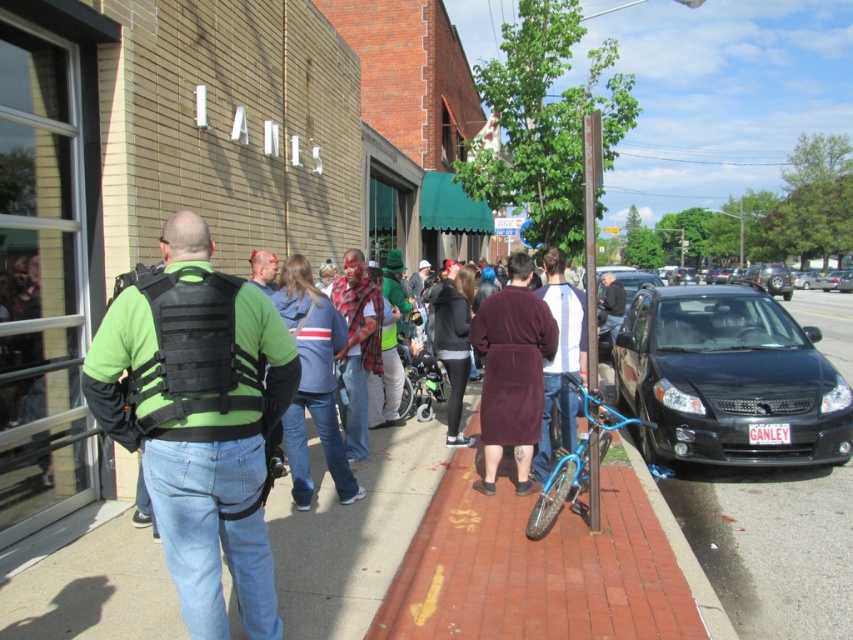
Is shiny blue bicycle at center above dark gray hoodie at center?

No, shiny blue bicycle at center is not above dark gray hoodie at center.

Is shiny blue bicycle at center in front of dark gray hoodie at center?

Yes, shiny blue bicycle at center is in front of dark gray hoodie at center.

You are a GUI agent. You are given a task and a screenshot of the screen. Output one action in this format:
    pyautogui.click(x=<x>, y=<y>)
    Task: Click on the shiny blue bicycle at center
    This screenshot has width=853, height=640.
    Given the screenshot: What is the action you would take?
    pyautogui.click(x=560, y=490)

Does ripped plaid shirt at center have a greater height compared to shiny blue bicycle at center?

Yes.

Identify the location of ripped plaid shirt at center. The height and width of the screenshot is (640, 853). (357, 348).

Consider the image. Is black glossy sedan at right positioned before white/gray long-sleeve shirt at center?

No, black glossy sedan at right is behind white/gray long-sleeve shirt at center.

Does point (807, 371) lie in front of point (544, 416)?

No.

Measure the distance between black glossy sedan at right and camera.

black glossy sedan at right and camera are 6.51 meters apart from each other.

The height and width of the screenshot is (640, 853). I want to click on black glossy sedan at right, so click(x=728, y=380).